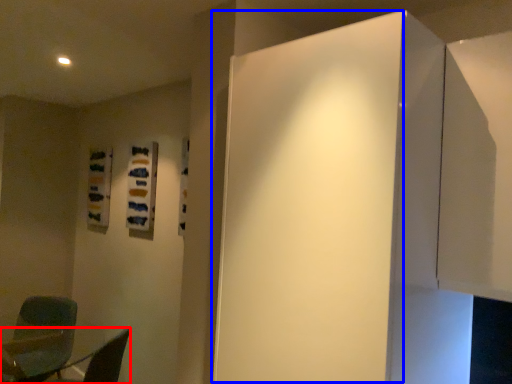
Question: Which object is closer to the camera taking this photo, furniture (highlighted by a red box) or door (highlighted by a blue box)?

Choices:
 (A) furniture
 (B) door

Answer: (B)